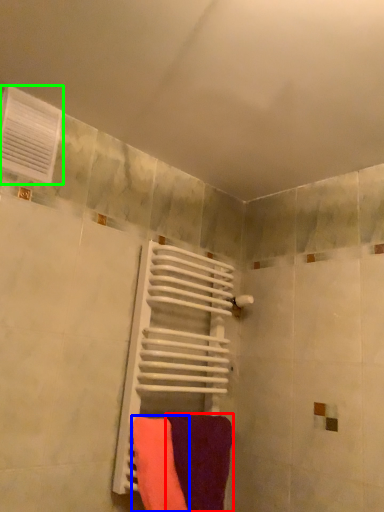
Question: Based on their relative distances, which object is nearer to towel (highlighted by a red box)? Choose from towel (highlighted by a blue box) and air conditioning (highlighted by a green box).

Choices:
 (A) towel
 (B) air conditioning

Answer: (A)